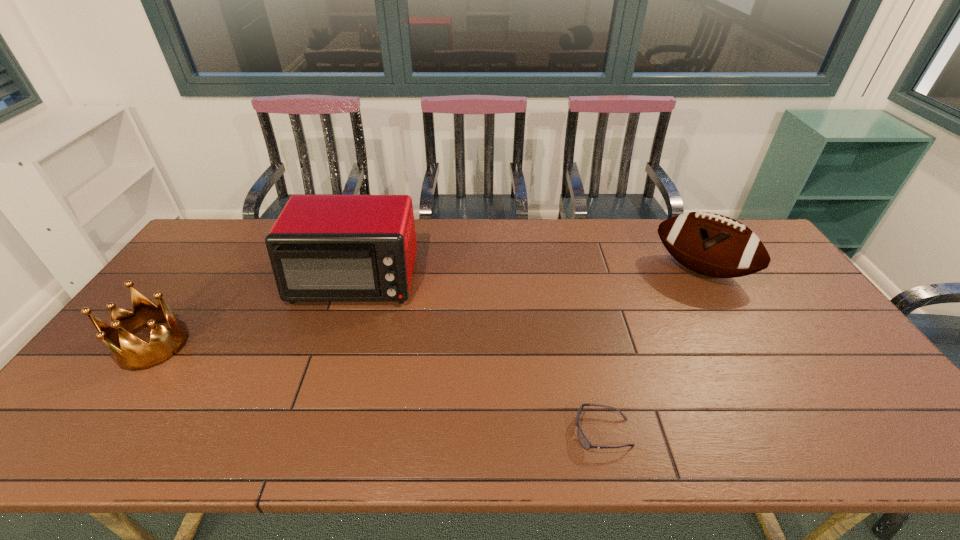
Where is `free space between the second object from left to right and the nearest object`? This screenshot has height=540, width=960. free space between the second object from left to right and the nearest object is located at coordinates (479, 356).

Where is `free spot between the football (American) and the toaster oven`? free spot between the football (American) and the toaster oven is located at coordinates (528, 275).

Find the location of `object that ranks as the closest to the rightmost object`. object that ranks as the closest to the rightmost object is located at coordinates (584, 442).

Locate an element on the screen. object that is the third closest to the second object from left to right is located at coordinates (710, 244).